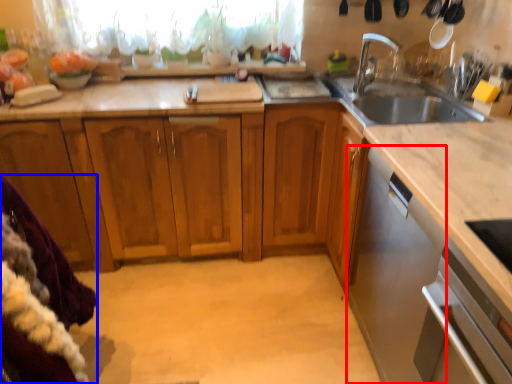
Question: Among these objects, which one is farthest to the camera, dish washer (highlighted by a red box) or blanket (highlighted by a blue box)?

Choices:
 (A) dish washer
 (B) blanket

Answer: (A)